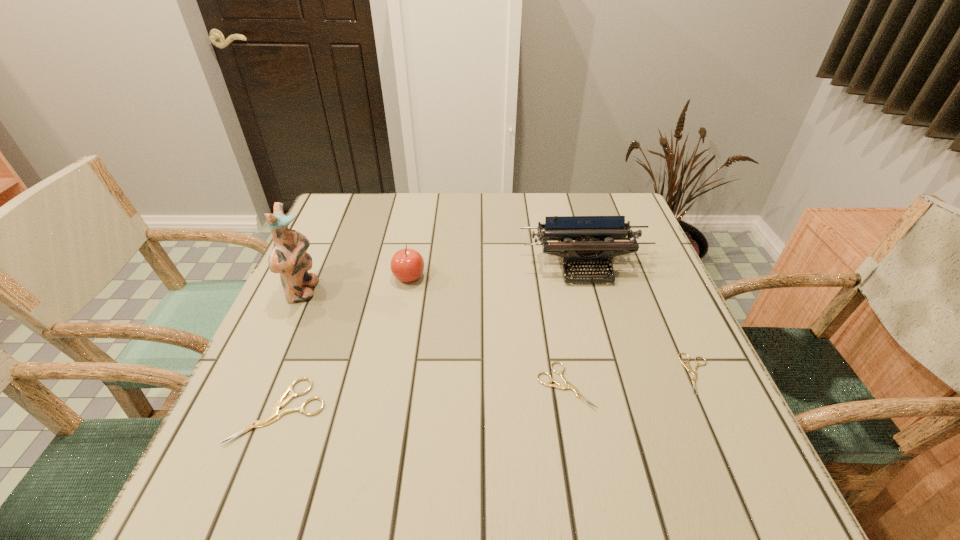
The height and width of the screenshot is (540, 960). Find the location of `vacant position for inserting another shears evenly`. vacant position for inserting another shears evenly is located at coordinates (425, 398).